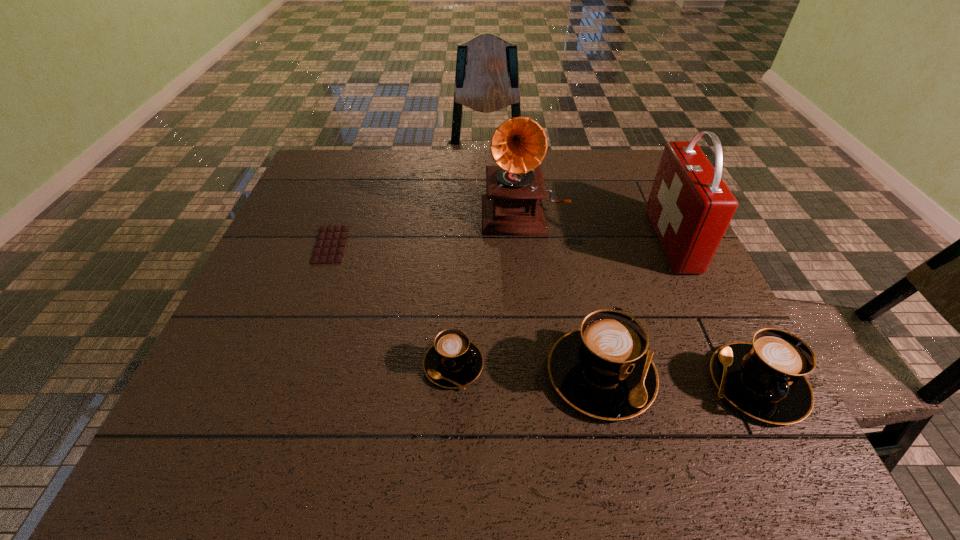
You are a GUI agent. You are given a task and a screenshot of the screen. Output one action in this format:
    pyautogui.click(x=<x>, y=<y>)
    Task: Click on the vacant space that satisfies the following two spatial constraints: 1. on the front side of the third shortest object; 2. on the left side of the second cappuccino from left to right
    This screenshot has height=540, width=960.
    Given the screenshot: What is the action you would take?
    pyautogui.click(x=604, y=384)

This screenshot has width=960, height=540. Find the location of `free space in the image that satisfies the following two spatial constraints: 1. on the horn of the second cappuccino from right to left; 2. on the right side of the phonograph record`. free space in the image that satisfies the following two spatial constraints: 1. on the horn of the second cappuccino from right to left; 2. on the right side of the phonograph record is located at coordinates (544, 374).

Image resolution: width=960 pixels, height=540 pixels. I want to click on vacant space that satisfies the following two spatial constraints: 1. on the horn of the rightmost cappuccino; 2. on the right side of the phonograph record, so click(x=545, y=384).